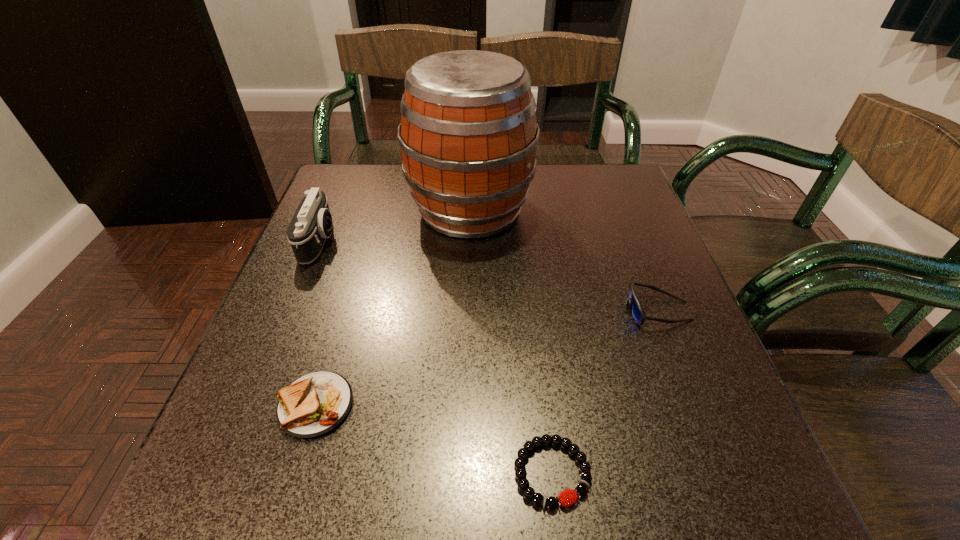
Where is `vacant space located on the front-facing side of the third nearest object`? The image size is (960, 540). vacant space located on the front-facing side of the third nearest object is located at coordinates (455, 310).

Where is `vacant region located 0.240m on the front-facing side of the third nearest object`? This screenshot has width=960, height=540. vacant region located 0.240m on the front-facing side of the third nearest object is located at coordinates (501, 310).

Identify the location of vacant space located on the front-facing side of the third nearest object. The image size is (960, 540). (461, 310).

Locate an element on the screen. Image resolution: width=960 pixels, height=540 pixels. vacant space situated on the left of the sandwich is located at coordinates (229, 405).

Locate an element on the screen. This screenshot has width=960, height=540. free space located on the left of the bracelet is located at coordinates (243, 472).

Find the location of `object located at the far edge`. object located at the far edge is located at coordinates (468, 134).

Find the location of a particular element. This screenshot has width=960, height=540. object that is at the near edge is located at coordinates (538, 499).

The width and height of the screenshot is (960, 540). Identify the location of camera present at the left edge. pyautogui.click(x=311, y=224).

Find the location of a particular element. The image size is (960, 540). sandwich positioned at the left edge is located at coordinates tap(313, 405).

This screenshot has width=960, height=540. Find the location of `object positioned at the right edge`. object positioned at the right edge is located at coordinates (636, 311).